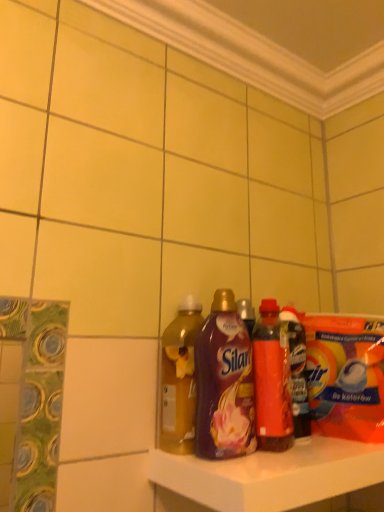
Identify the location of vacant area that is situated to the right of shiny plastic bottle at center, the 2th bottle when ordered from right to left. The width and height of the screenshot is (384, 512). (329, 446).